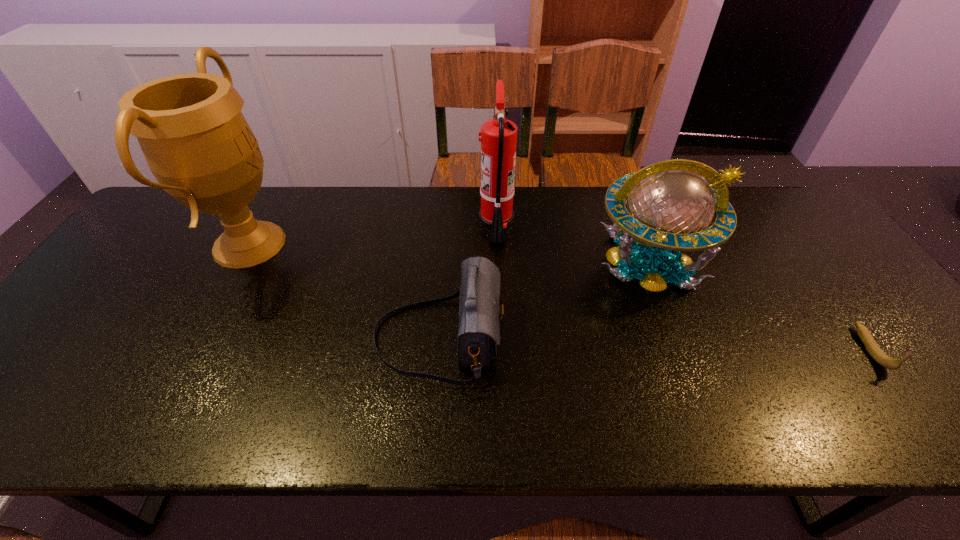
Locate an element on the screen. This screenshot has height=540, width=960. free space located at the nozzle of the second tallest object is located at coordinates (420, 225).

Identify the location of vacant space located 0.220m at the nozzle of the second tallest object. Image resolution: width=960 pixels, height=540 pixels. (407, 225).

This screenshot has height=540, width=960. Identify the location of vacant space located on the front of the third shortest object. (706, 408).

Find the location of a particular element. This screenshot has height=540, width=960. free space located on the right of the fourth tallest object is located at coordinates (569, 337).

What are the coordinates of `free point located at the stem of the banana` in the screenshot? It's located at (924, 422).

Find the location of a particular element. trophy that is at the far edge is located at coordinates (197, 143).

Where is `fire extinguisher present at the far edge`? This screenshot has height=540, width=960. fire extinguisher present at the far edge is located at coordinates (498, 139).

This screenshot has width=960, height=540. Identify the location of globe positioned at the far edge. (671, 207).

This screenshot has width=960, height=540. I want to click on object present at the right edge, so click(874, 350).

Identify the location of free space at the far edge. (451, 204).